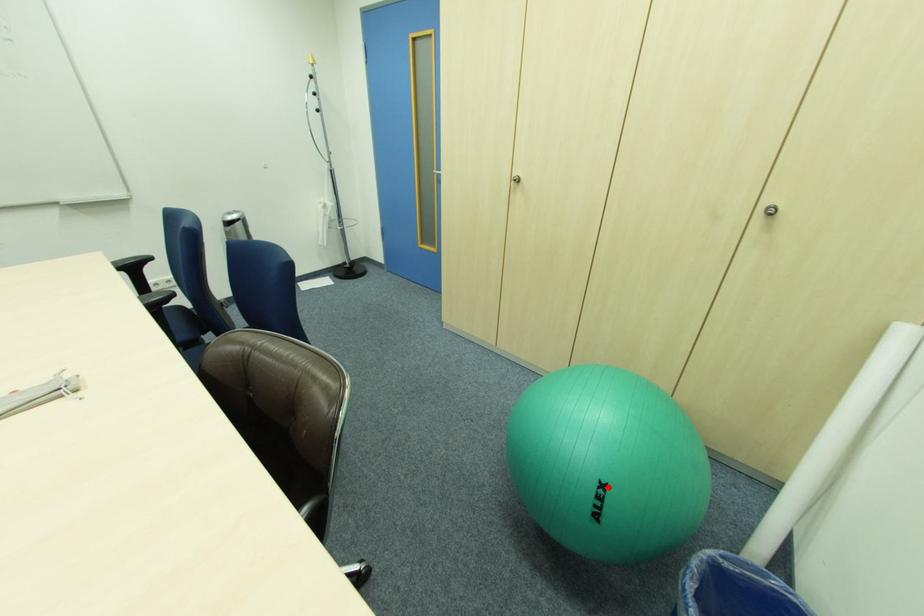
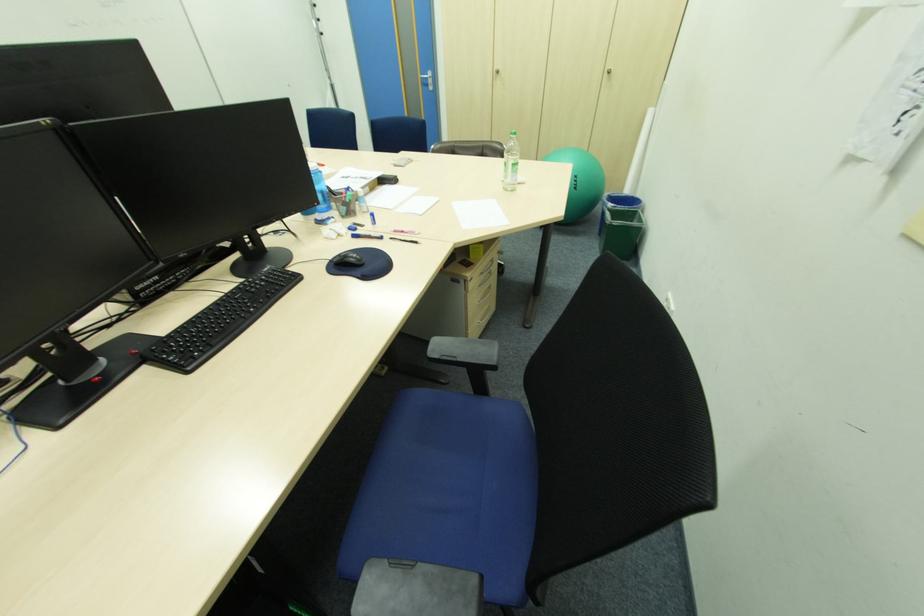
Question: I am providing you with two images of the same scene from different viewpoints. In image1, a red point is highlighted. Considering the same 3D point in image2, which of the following is correct?

Choices:
 (A) It is closer
 (B) It is farther

Answer: (A)